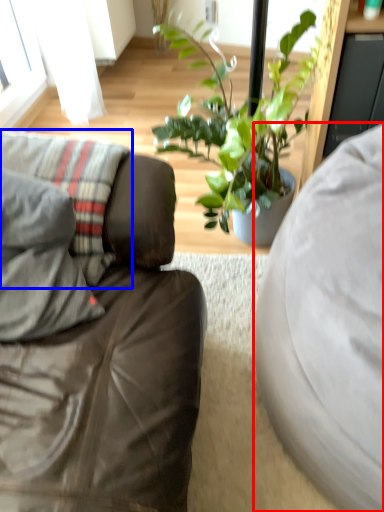
Question: Which point is further to the camera, studio couch (highlighted by a red box) or pillow (highlighted by a blue box)?

Choices:
 (A) studio couch
 (B) pillow

Answer: (B)